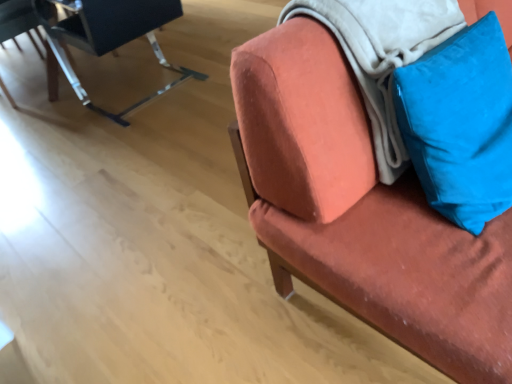
Question: From a real-world perspective, does velvet orange chair at upper right, the 1th chair in the right-to-left sequence, stand above blue velvet pillow at upper right?

Choices:
 (A) no
 (B) yes

Answer: (A)

Question: Does velvet orange chair at upper right, which is the 3th chair in left-to-right order, have a greater width compared to blue velvet pillow at upper right?

Choices:
 (A) yes
 (B) no

Answer: (A)

Question: Does velvet orange chair at upper right, the 1th chair in the right-to-left sequence, have a smaller size compared to blue velvet pillow at upper right?

Choices:
 (A) yes
 (B) no

Answer: (B)

Question: Is velvet orange chair at upper right, the 1th chair in the right-to-left sequence, looking in the opposite direction of blue velvet pillow at upper right?

Choices:
 (A) yes
 (B) no

Answer: (A)

Question: Is velvet orange chair at upper right, the 1th chair in the right-to-left sequence, thinner than blue velvet pillow at upper right?

Choices:
 (A) no
 (B) yes

Answer: (A)

Question: Does velvet orange chair at upper right, which is the 3th chair in left-to-right order, have a greater height compared to blue velvet pillow at upper right?

Choices:
 (A) yes
 (B) no

Answer: (A)

Question: From a real-world perspective, is soft white blanket at upper right beneath metallic black chair at upper left, which appears as the second chair when viewed from the right?

Choices:
 (A) no
 (B) yes

Answer: (A)

Question: Is soft white blanket at upper right positioned in front of metallic black chair at upper left, the second chair from the left?

Choices:
 (A) yes
 (B) no

Answer: (A)

Question: From the image's perspective, would you say soft white blanket at upper right is positioned over metallic black chair at upper left, which appears as the second chair when viewed from the right?

Choices:
 (A) no
 (B) yes

Answer: (A)

Question: Does soft white blanket at upper right have a lesser height compared to metallic black chair at upper left, the second chair from the left?

Choices:
 (A) no
 (B) yes

Answer: (B)

Question: Does soft white blanket at upper right contain metallic black chair at upper left, which appears as the second chair when viewed from the right?

Choices:
 (A) no
 (B) yes

Answer: (A)

Question: From a real-world perspective, is soft white blanket at upper right physically above metallic black chair at upper left, the second chair from the left?

Choices:
 (A) no
 (B) yes

Answer: (B)

Question: Can you confirm if metallic black chair at upper left, the second chair from the left, is bigger than soft white blanket at upper right?

Choices:
 (A) yes
 (B) no

Answer: (A)